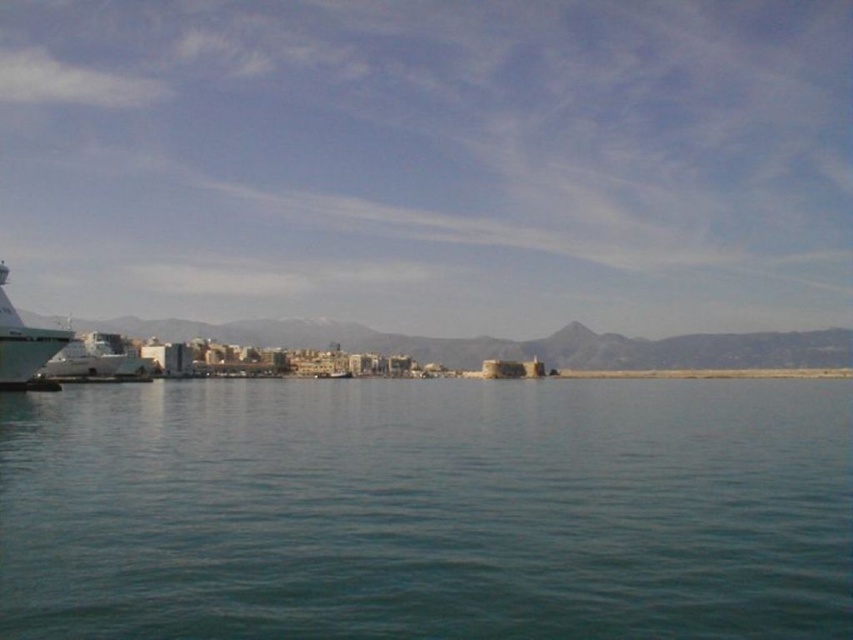
Which is above, clear blue water at center or white glossy boat at left?

white glossy boat at left is above.

Can you confirm if clear blue water at center is positioned to the right of white glossy boat at left?

Correct, you'll find clear blue water at center to the right of white glossy boat at left.

Find the location of `clear blue water at center`. clear blue water at center is located at coordinates (427, 509).

You are a GUI agent. You are given a task and a screenshot of the screen. Output one action in this format:
    pyautogui.click(x=<x>, y=<y>)
    Task: Click on the clear blue water at center
    The height and width of the screenshot is (640, 853).
    Given the screenshot: What is the action you would take?
    pyautogui.click(x=427, y=509)